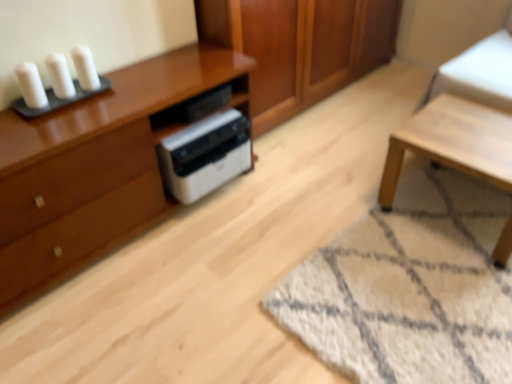
At what (x,y) coordinates should I click in order to perform the action: click on free point in front of white matte candle at upper left, acting as the third candle starting from the right. Please return your answer as a coordinate pair (x, y). This screenshot has height=384, width=512. Looking at the image, I should click on (20, 131).